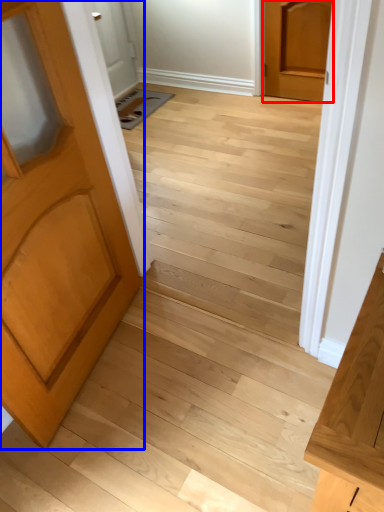
Question: Which of the following is the farthest to the observer, door (highlighted by a red box) or door (highlighted by a blue box)?

Choices:
 (A) door
 (B) door

Answer: (A)